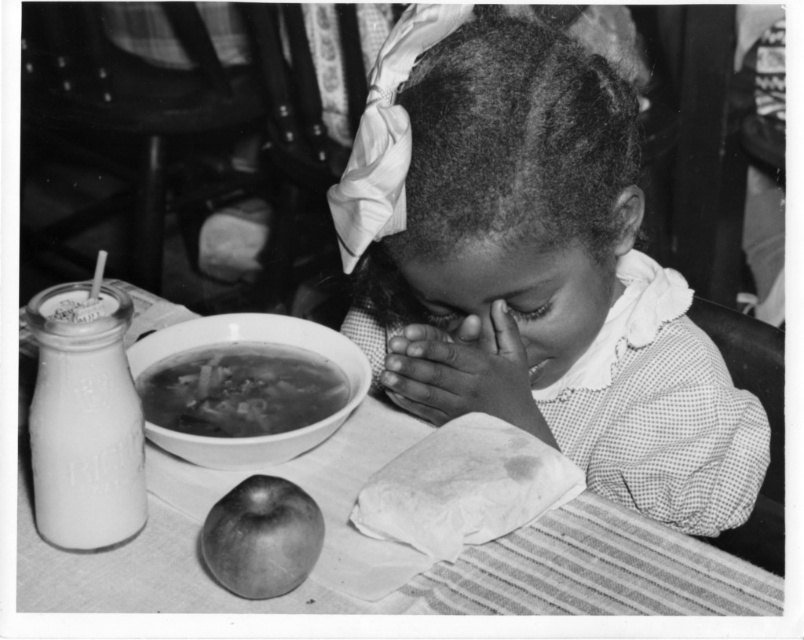
Question: Is smooth skin hands at center bigger than shiny silver apple at lower left?

Choices:
 (A) yes
 (B) no

Answer: (A)

Question: Where is white ceramic bowl at upper center located in relation to shiny silver apple at lower left in the image?

Choices:
 (A) left
 (B) right

Answer: (A)

Question: Which point appears closest to the camera in this image?

Choices:
 (A) (630, 586)
 (B) (405, 403)
 (C) (224, 541)
 (D) (97, 339)

Answer: (C)

Question: Which point is farther to the camera?

Choices:
 (A) shiny silver apple at lower left
 (B) smooth fabric headscarf at upper center
 (C) smooth white table at center
 (D) white ceramic bowl at upper center

Answer: (D)

Question: Does smooth white table at center appear on the left side of shiny silver apple at lower left?

Choices:
 (A) no
 (B) yes

Answer: (A)

Question: Which object appears farthest from the camera in this image?

Choices:
 (A) white opaque glass bottle at left
 (B) shiny silver apple at lower left

Answer: (B)